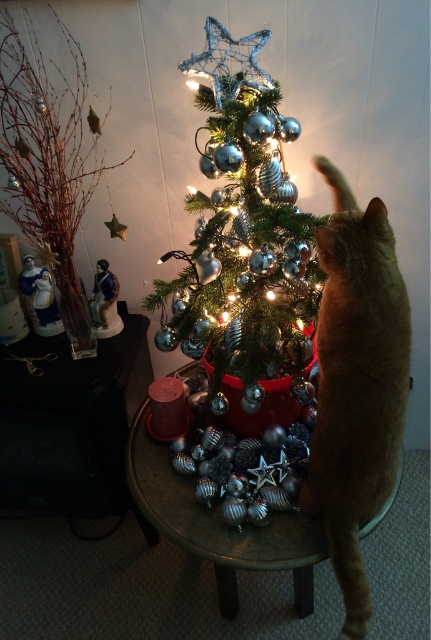
You are a guest at a holiday party and see the orange fur cat at right and the metallic silver table at center. Which object is larger in size?

The orange fur cat at right has a smaller size compared to the metallic silver table at center, so the metallic silver table at center is larger in size.

From the picture: You are standing in front of the metallic silver table at center and want to place a gift under the shiny metallic tree at center. Which direction should you move to reach the tree?

The shiny metallic tree at center is to the right of the metallic silver table at center, so you should move to your right to reach the tree.